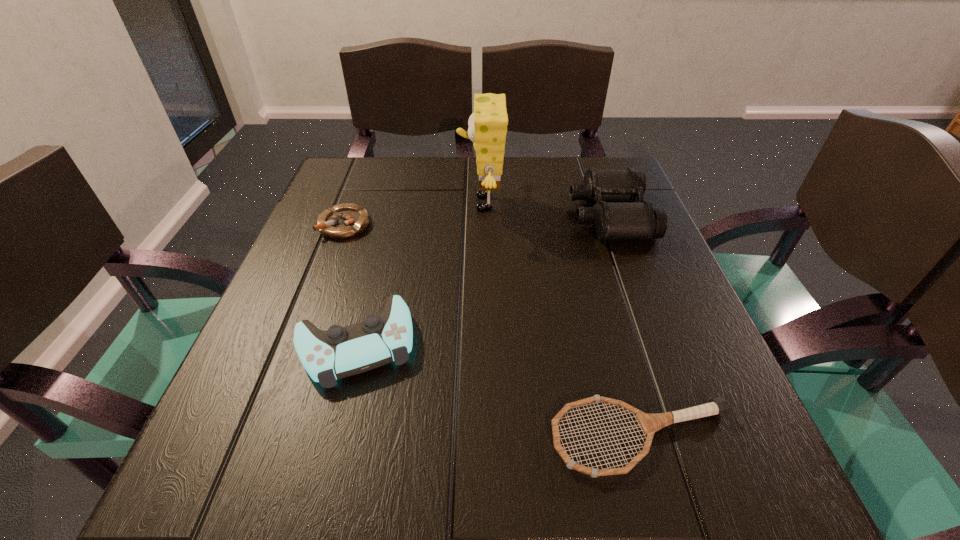
Where is `free spot at the far right corner of the desktop`? free spot at the far right corner of the desktop is located at coordinates (593, 160).

Where is `vacant space that's between the fourth shortest object and the tennis racket`? The width and height of the screenshot is (960, 540). vacant space that's between the fourth shortest object and the tennis racket is located at coordinates (626, 327).

Locate an element on the screen. This screenshot has height=540, width=960. vacant area that lies between the sponge and the second nearest object is located at coordinates (418, 273).

I want to click on free space between the ashtray and the tennis racket, so click(x=493, y=332).

Where is `empty space between the ashtray and the control`? The height and width of the screenshot is (540, 960). empty space between the ashtray and the control is located at coordinates (349, 284).

At what (x,y) coordinates should I click in order to perform the action: click on unoccupied position between the fourth shortest object and the nearest object. Please return your answer as a coordinate pair (x, y). This screenshot has width=960, height=540. Looking at the image, I should click on (626, 327).

The width and height of the screenshot is (960, 540). Find the location of `free space between the tennis racket and the ashtray`. free space between the tennis racket and the ashtray is located at coordinates (493, 332).

Find the location of a particular element. free space between the ashtray and the tallest object is located at coordinates (413, 214).

Image resolution: width=960 pixels, height=540 pixels. I want to click on free spot between the sponge and the ashtray, so click(x=413, y=214).

Image resolution: width=960 pixels, height=540 pixels. What are the coordinates of `vacant space that is in between the binoculars and the tallest object` in the screenshot? It's located at 545,210.